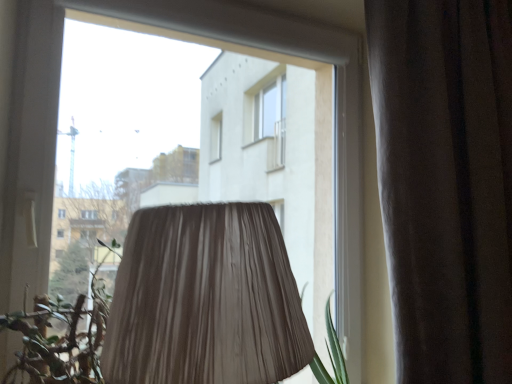
What do you see at coordinates (60, 339) in the screenshot? I see `green leafy plant at lower left` at bounding box center [60, 339].

Where is `green leafy plant at lower left`? Image resolution: width=512 pixels, height=384 pixels. green leafy plant at lower left is located at coordinates (60, 339).

Locate an element on the screen. The image size is (512, 384). brown velvet curtain at right is located at coordinates (446, 182).

Describe the element at coordinates (446, 182) in the screenshot. The width and height of the screenshot is (512, 384). I see `brown velvet curtain at right` at that location.

You are a GUI agent. You are given a task and a screenshot of the screen. Output one action in this format:
    pyautogui.click(x=<x>, y=<y>)
    Task: Click on the green leafy plant at lower left
    The width and height of the screenshot is (512, 384).
    Given the screenshot: What is the action you would take?
    [60, 339]

Is brown velvet curtain at right at the right side of green leafy plant at lower left?

Yes.

Is brown velvet curtain at right behind green leafy plant at lower left?

Yes, brown velvet curtain at right is further from the viewer.

Does point (499, 367) appear closer or farther from the camera than point (76, 307)?

Point (499, 367) appears to be farther away from the viewer than point (76, 307).

From the image's perspective, would you say brown velvet curtain at right is positioned over green leafy plant at lower left?

Yes, from the image's perspective, brown velvet curtain at right is on top of green leafy plant at lower left.

From the picture: From a real-world perspective, relative to green leafy plant at lower left, is brown velvet curtain at right vertically above or below?

From a real-world perspective, brown velvet curtain at right is physically above green leafy plant at lower left.

Looking at their sizes, would you say brown velvet curtain at right is wider or thinner than green leafy plant at lower left?

Considering their sizes, brown velvet curtain at right looks slimmer than green leafy plant at lower left.

From their relative heights in the image, would you say brown velvet curtain at right is taller or shorter than green leafy plant at lower left?

In the image, brown velvet curtain at right appears to be taller than green leafy plant at lower left.

Considering the relative sizes of brown velvet curtain at right and green leafy plant at lower left in the image provided, is brown velvet curtain at right smaller than green leafy plant at lower left?

No, brown velvet curtain at right is not smaller than green leafy plant at lower left.

Choose the correct answer: Is brown velvet curtain at right inside green leafy plant at lower left or outside it?

brown velvet curtain at right exists outside the volume of green leafy plant at lower left.

Based on the photo, are brown velvet curtain at right and green leafy plant at lower left located far from each other?

No, brown velvet curtain at right is not far from green leafy plant at lower left.

In the scene shown: Is brown velvet curtain at right aimed at green leafy plant at lower left?

No, brown velvet curtain at right is not facing towards green leafy plant at lower left.

Measure the distance between brown velvet curtain at right and green leafy plant at lower left.

brown velvet curtain at right is 37.11 inches away from green leafy plant at lower left.

In the image, there is a green leafy plant at lower left. Where is `curtain above it (from the image's perspective)`? curtain above it (from the image's perspective) is located at coordinates (446, 182).

Is green leafy plant at lower left at the left side of brown velvet curtain at right?

Yes.

Which object is more forward, green leafy plant at lower left or brown velvet curtain at right?

green leafy plant at lower left is closer to the camera.

Considering the positions of points (37, 331) and (476, 250), is point (37, 331) farther from camera compared to point (476, 250)?

No, it is not.

From the image's perspective, is green leafy plant at lower left above or below brown velvet curtain at right?

green leafy plant at lower left is below brown velvet curtain at right.

From a real-world perspective, who is located lower, green leafy plant at lower left or brown velvet curtain at right?

green leafy plant at lower left, from a real-world perspective.

Does green leafy plant at lower left have a greater width compared to brown velvet curtain at right?

Yes, green leafy plant at lower left is wider than brown velvet curtain at right.

Which of these two, green leafy plant at lower left or brown velvet curtain at right, stands shorter?

Standing shorter between the two is green leafy plant at lower left.

Who is bigger, green leafy plant at lower left or brown velvet curtain at right?

brown velvet curtain at right.

Is green leafy plant at lower left positioned beyond the bounds of brown velvet curtain at right?

Yes.

Does green leafy plant at lower left touch brown velvet curtain at right?

green leafy plant at lower left and brown velvet curtain at right are not in contact.

Is green leafy plant at lower left looking in the opposite direction of brown velvet curtain at right?

green leafy plant at lower left does not have its back to brown velvet curtain at right.

Can you tell me how much green leafy plant at lower left and brown velvet curtain at right differ in facing direction?

The angle between the facing direction of green leafy plant at lower left and the facing direction of brown velvet curtain at right is 1.05 degrees.

Find the location of a particular element. The width and height of the screenshot is (512, 384). curtain located on the right of green leafy plant at lower left is located at coordinates (446, 182).

At what (x,y) coordinates should I click in order to perform the action: click on vegetation located underneath the brown velvet curtain at right (from a real-world perspective). Please return your answer as a coordinate pair (x, y). This screenshot has height=384, width=512. Looking at the image, I should click on (60, 339).

Image resolution: width=512 pixels, height=384 pixels. What are the coordinates of `vegetation located below the brown velvet curtain at right (from the image's perspective)` in the screenshot? It's located at (60, 339).